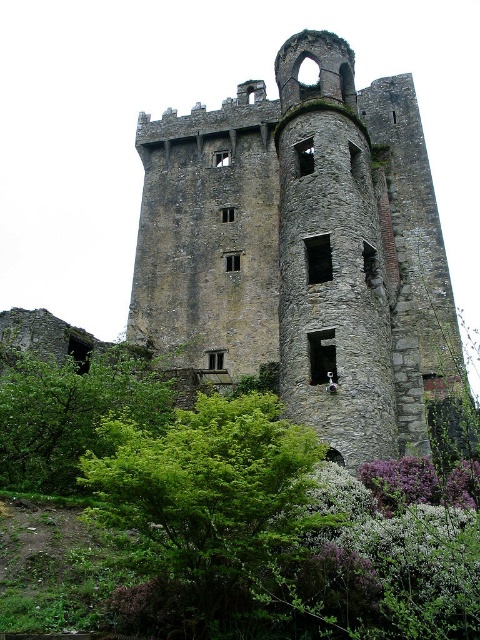
You are standing in front of the gray stone tower at center and the green leafy bush at lower center. Which object is closer to you?

The gray stone tower at center is closer to you than the green leafy bush at lower center because it is positioned further away from the viewer.

You are planning to build a small garden between the gray stone tower at center and the green leafy tree at lower left. To ensure enough space, you need to know which one is wider. Can you determine which object is wider?

The gray stone tower at center is wider than the green leafy tree at lower left according to the description.

You are standing at the base of the historic stone tower and notice two plants nearby. The green leafy bush at lower center and the green leafy tree at lower left. Which one appears larger in size?

The green leafy bush at lower center is bigger than the green leafy tree at lower left.